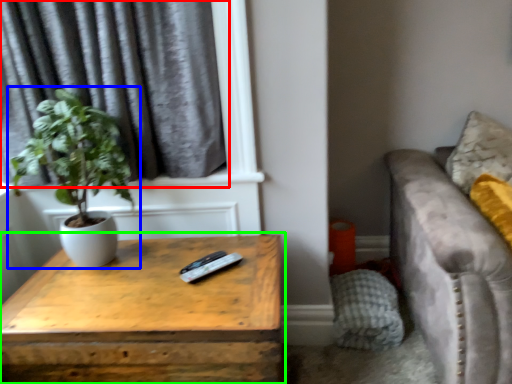
Question: Based on their relative distances, which object is farther from curtain (highlighted by a red box)? Choose from houseplant (highlighted by a blue box) and table (highlighted by a green box).

Choices:
 (A) houseplant
 (B) table

Answer: (B)